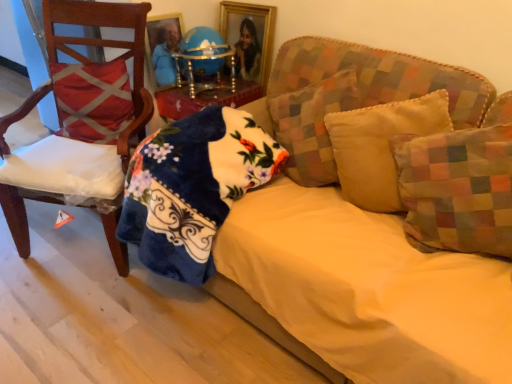
Question: Is yellow fabric pillow at center, arranged as the 2th pillow when viewed from the right, to the right of multicolored fabric pillow at right, which is the first pillow from right to left, from the viewer's perspective?

Choices:
 (A) no
 (B) yes

Answer: (A)

Question: From a real-world perspective, is yellow fabric pillow at center, arranged as the third pillow when viewed from the left, positioned over multicolored fabric pillow at right, the fourth pillow positioned from the left, based on gravity?

Choices:
 (A) no
 (B) yes

Answer: (A)

Question: Is yellow fabric pillow at center, arranged as the 2th pillow when viewed from the right, wider than multicolored fabric pillow at right, the fourth pillow positioned from the left?

Choices:
 (A) no
 (B) yes

Answer: (B)

Question: Is yellow fabric pillow at center, arranged as the third pillow when viewed from the left, beside multicolored fabric pillow at right, the fourth pillow positioned from the left?

Choices:
 (A) no
 (B) yes

Answer: (A)

Question: Is yellow fabric pillow at center, arranged as the 2th pillow when viewed from the right, positioned before multicolored fabric pillow at right, the fourth pillow positioned from the left?

Choices:
 (A) no
 (B) yes

Answer: (A)

Question: Can we say yellow fabric pillow at center, arranged as the third pillow when viewed from the left, lies outside multicolored fabric pillow at right, the fourth pillow positioned from the left?

Choices:
 (A) no
 (B) yes

Answer: (B)

Question: Can you confirm if velvet yellow couch at center is wider than wooden chair at left?

Choices:
 (A) no
 (B) yes

Answer: (B)

Question: Can you confirm if velvet yellow couch at center is thinner than wooden chair at left?

Choices:
 (A) no
 (B) yes

Answer: (A)

Question: Is velvet yellow couch at center facing towards wooden chair at left?

Choices:
 (A) yes
 (B) no

Answer: (B)

Question: From a real-world perspective, does velvet yellow couch at center sit lower than wooden chair at left?

Choices:
 (A) no
 (B) yes

Answer: (B)

Question: Can you confirm if velvet yellow couch at center is bigger than wooden chair at left?

Choices:
 (A) yes
 (B) no

Answer: (A)

Question: Is velvet yellow couch at center beside wooden chair at left?

Choices:
 (A) no
 (B) yes

Answer: (A)

Question: Does yellow fabric pillow at center, arranged as the 2th pillow when viewed from the right, have a greater height compared to blue glossy globe at center?

Choices:
 (A) yes
 (B) no

Answer: (A)